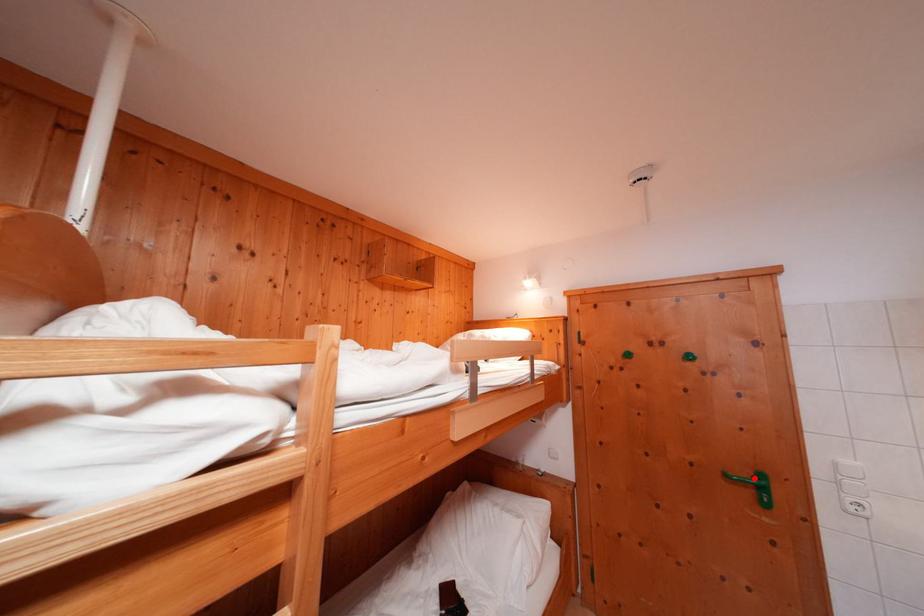
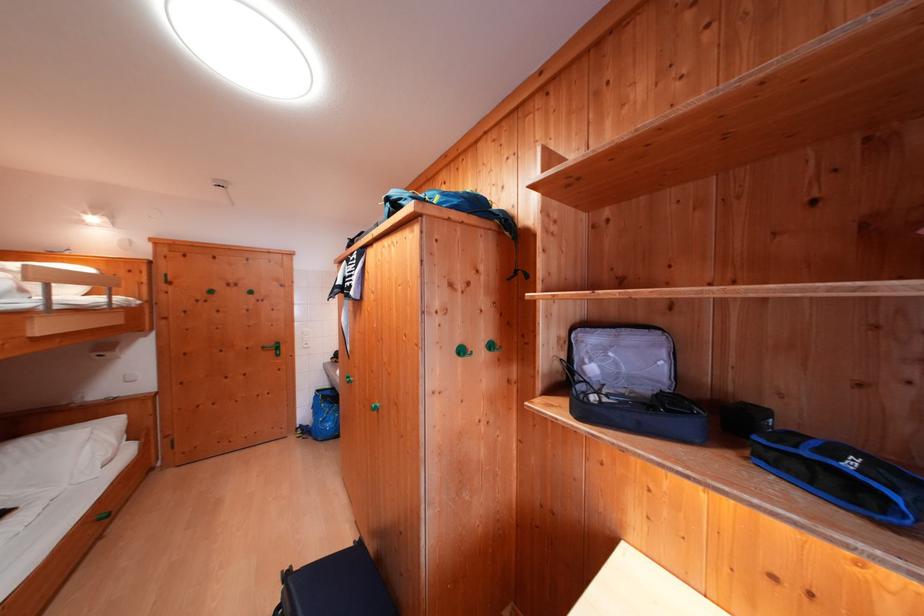
In the second image, find the point that corresponds to the highlighted location in the first image.

(280, 349)